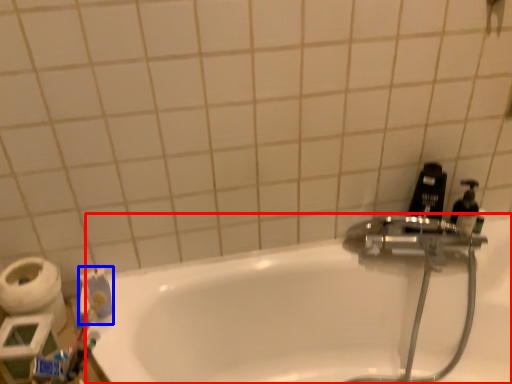
Question: Which object is further to the camera taking this photo, bathtub (highlighted by a red box) or toothpaste (highlighted by a blue box)?

Choices:
 (A) bathtub
 (B) toothpaste

Answer: (B)